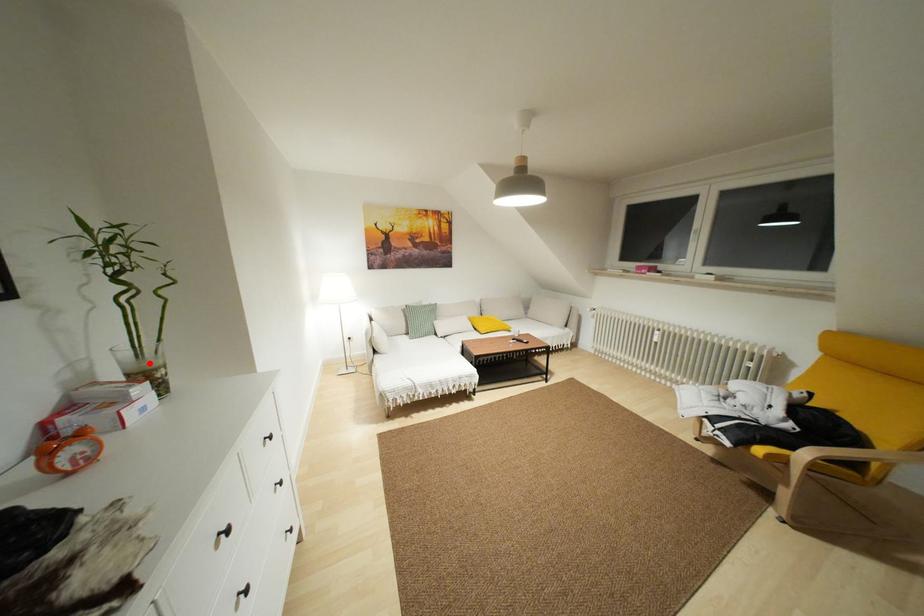
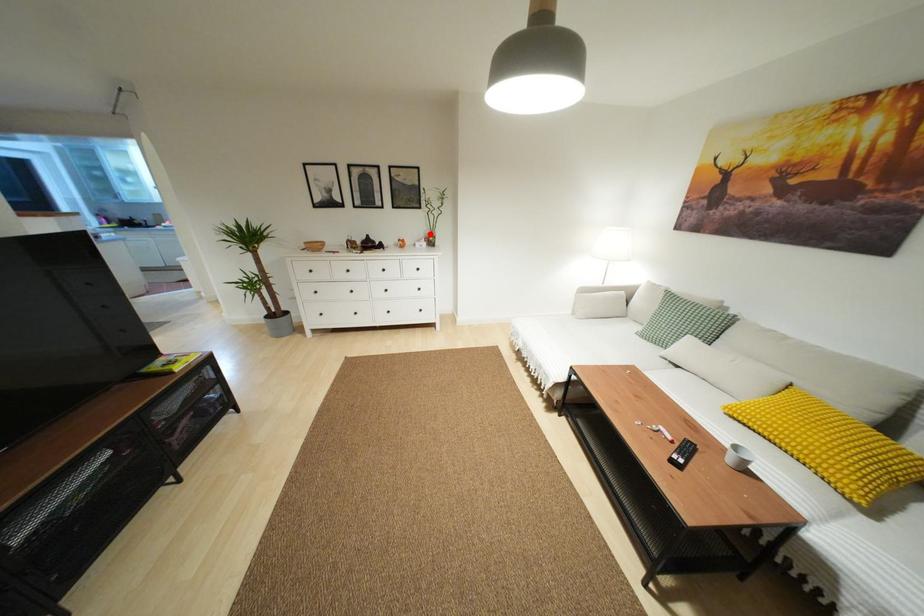
I am providing you with two images of the same scene from different viewpoints. A red point is marked on the first image and another point is marked on the second image. Does the point marked in image1 correspond to the same location as the one in image2?

Yes